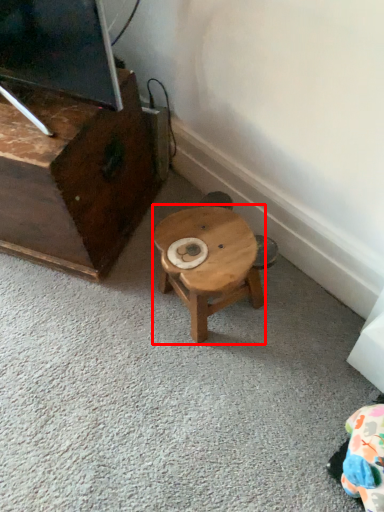
Question: From the image's perspective, where is stool (annotated by the red box) located relative to furniture?

Choices:
 (A) above
 (B) below

Answer: (B)